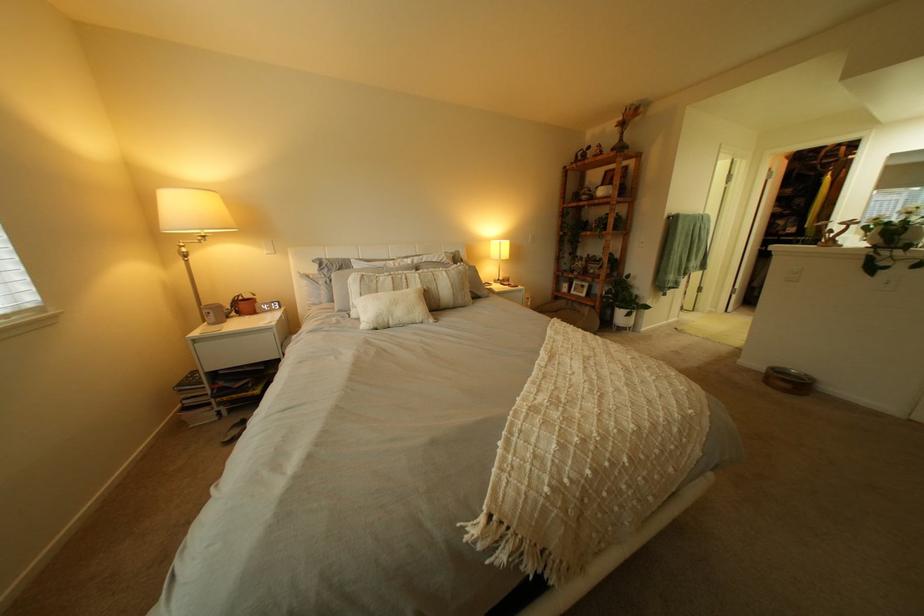
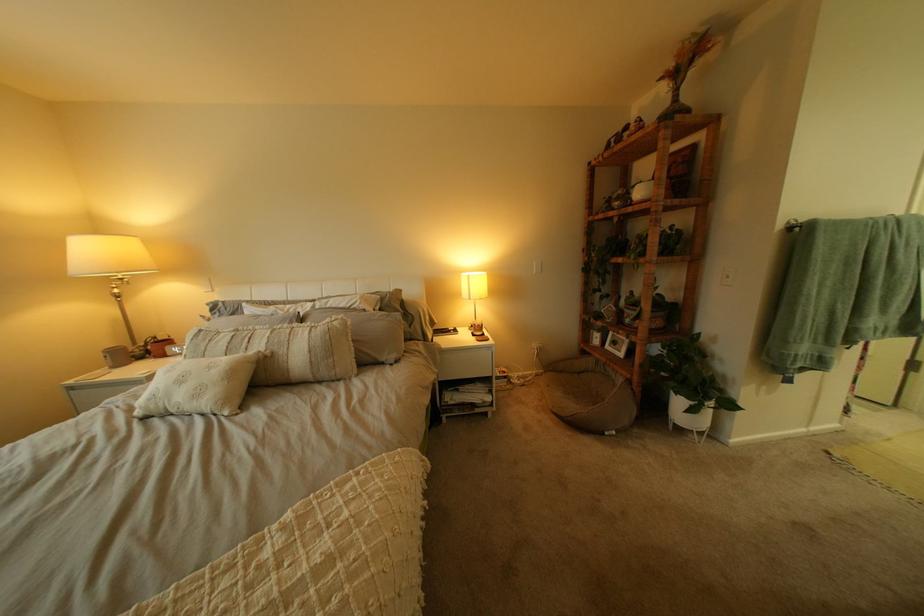
Where in the second image is the point corresponding to [633,305] from the first image?

(687, 385)